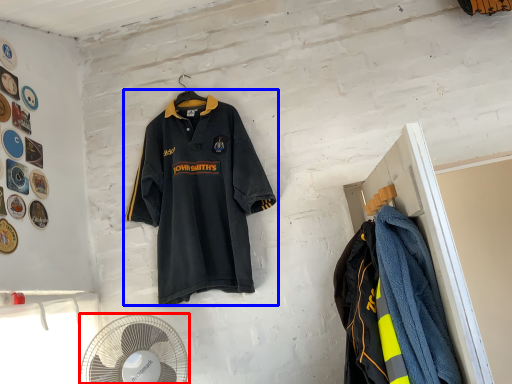
Question: Which point is closer to the camera, mechanical fan (highlighted by a red box) or sports uniform (highlighted by a blue box)?

Choices:
 (A) mechanical fan
 (B) sports uniform

Answer: (A)